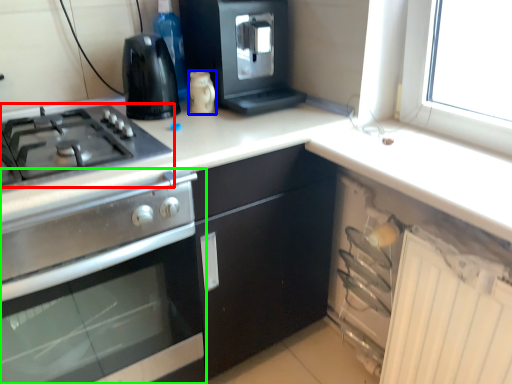
Question: Which object is the closest to the gas stove (highlighted by a red box)? Choose among these: kitchen appliance (highlighted by a blue box) or kitchen appliance (highlighted by a green box).

Choices:
 (A) kitchen appliance
 (B) kitchen appliance

Answer: (B)